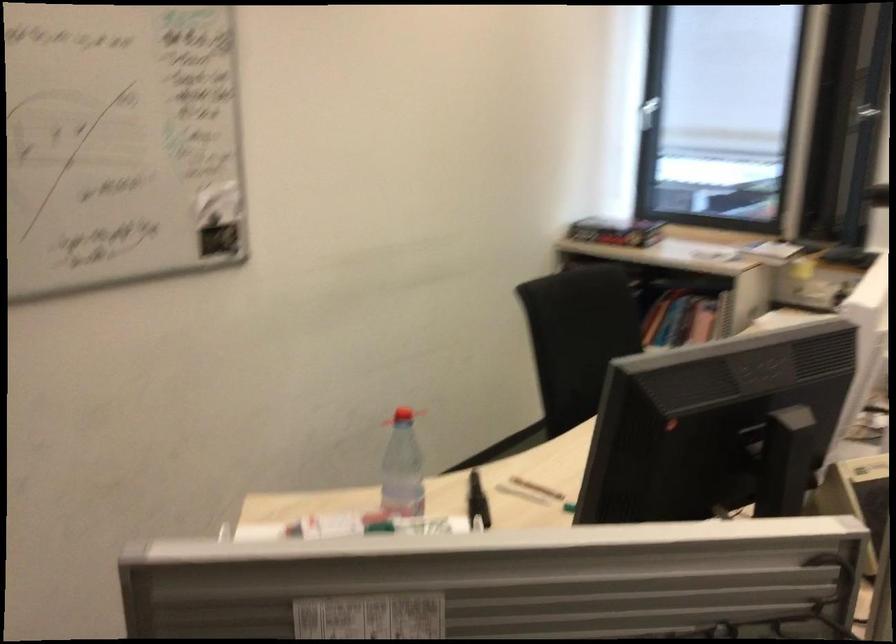
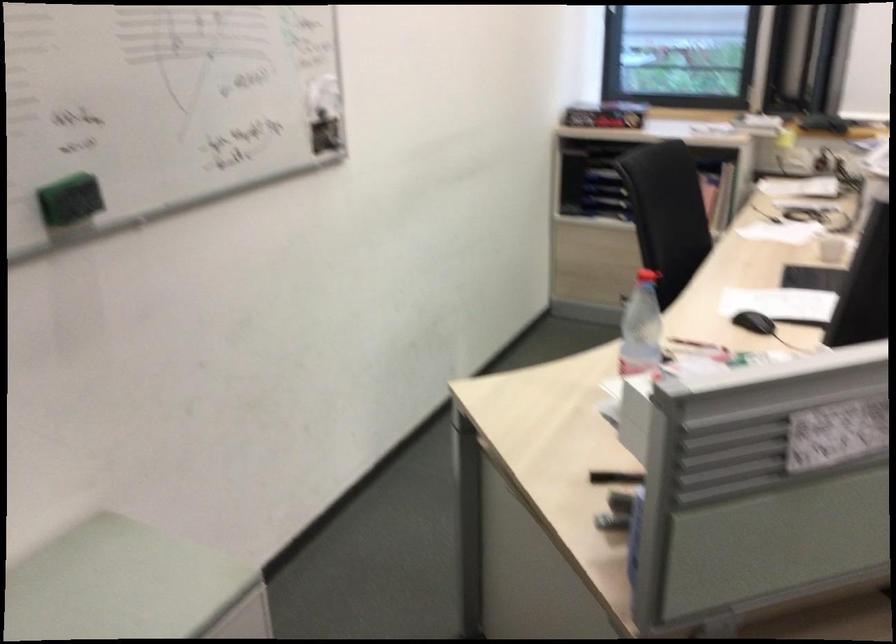
Locate, in the second image, the point that corresponds to the point at 410,466 in the first image.

(641, 327)